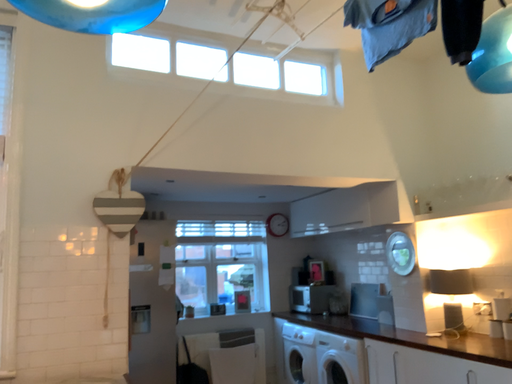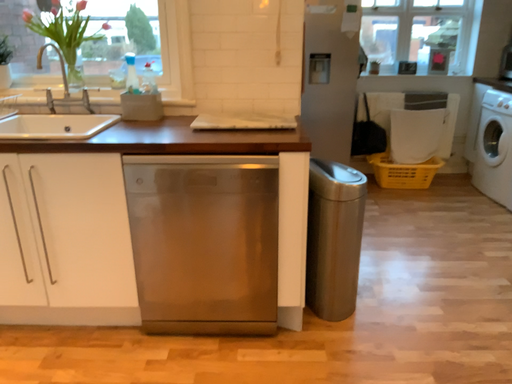
Question: Which way did the camera rotate in the video?

Choices:
 (A) rotated downward
 (B) rotated upward

Answer: (A)